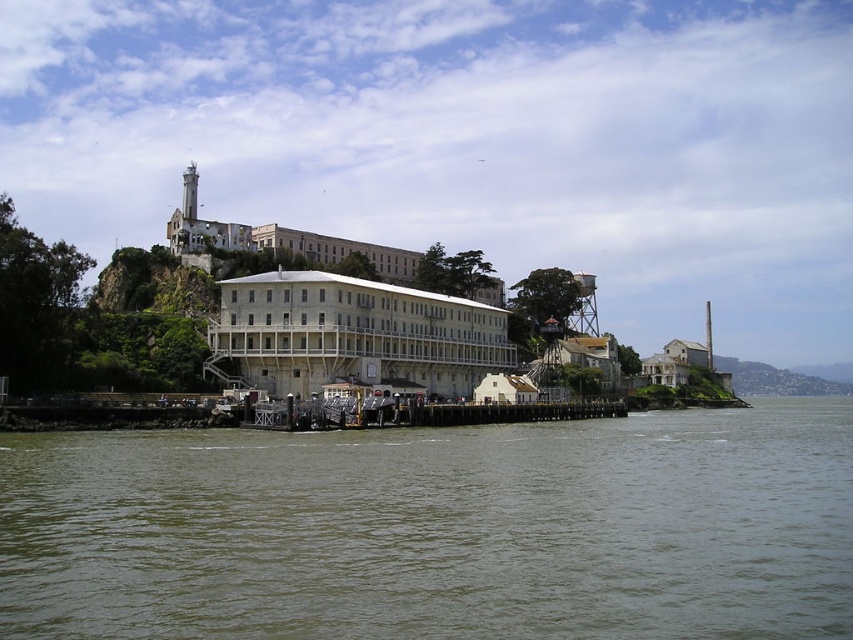
You are standing on the wooden pier at Alcatraz Island and looking towards the historic buildings. You notice two points marked in the image. Which of the two points, point (x=671, y=442) or point (x=187, y=227), is closer to your current position on the pier?

Point (x=671, y=442) is closer to the camera than point (x=187, y=227), so the point closer to your current position on the pier is point (x=671, y=442).

You are standing on the wooden pier at Alcatraz Island and want to know how far the greenish water at lower center is from your current position. Can you determine the distance?

The greenish water at lower center is 28.08 meters away from the viewer, so the distance between the viewer and the greenish water at lower center is 28.08 meters.